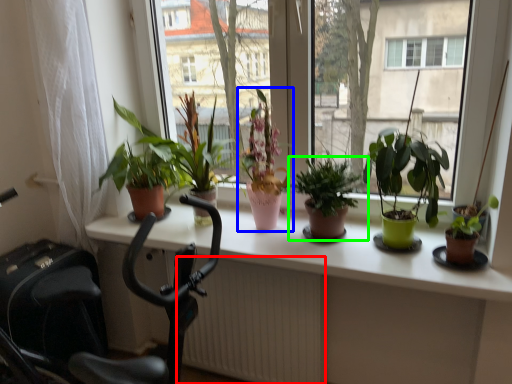
Question: Which is farther away from radiator (highlighted by a red box)? houseplant (highlighted by a blue box) or houseplant (highlighted by a green box)?

Choices:
 (A) houseplant
 (B) houseplant

Answer: (B)